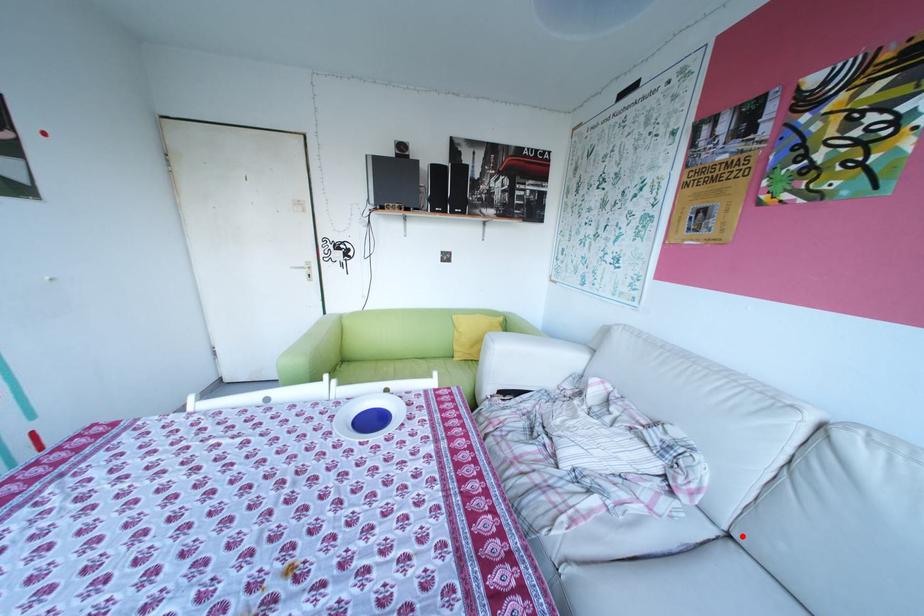
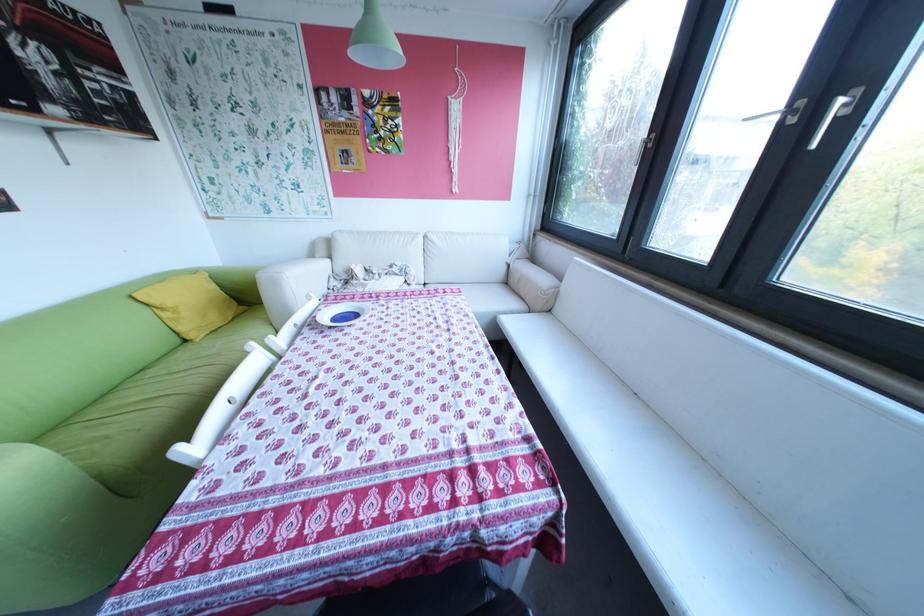
Question: I am providing you with two images of the same scene from different viewpoints. Given a red point in image1, look at the same physical point in image2. Is it:

Choices:
 (A) Closer to the viewpoint
 (B) Farther from the viewpoint

Answer: (B)